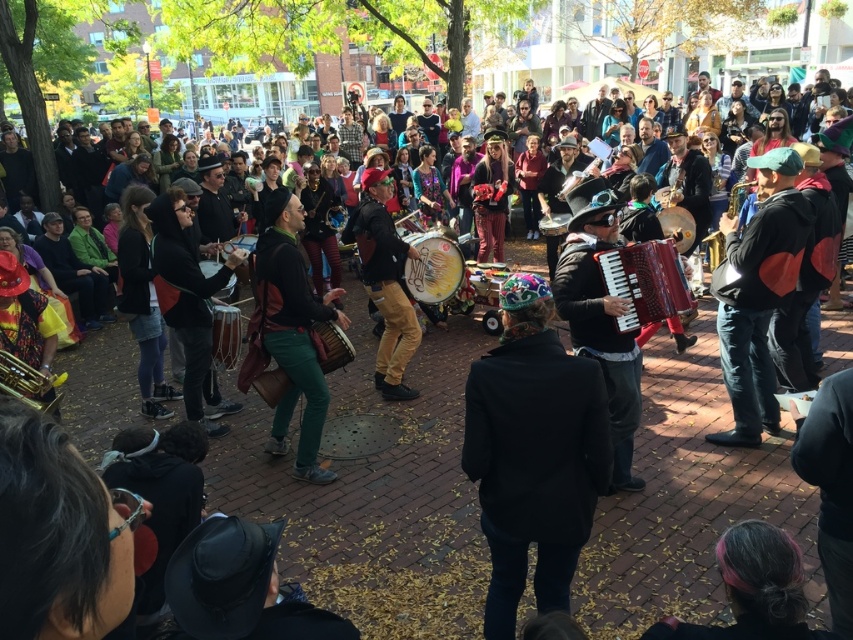
Which of these two, brass/yellowish metal trumpet at lower left or brown leather drum at center, stands shorter?

brown leather drum at center

Is brass/yellowish metal trumpet at lower left smaller than brown leather drum at center?

No, brass/yellowish metal trumpet at lower left is not smaller than brown leather drum at center.

Who is more forward, (x=38, y=381) or (x=277, y=384)?

Positioned in front is point (x=38, y=381).

Identify the location of brass/yellowish metal trumpet at lower left. The image size is (853, 640). (28, 384).

Can you confirm if brass/yellowish metal trumpet at lower left is thinner than matte brown drum at center?

No, brass/yellowish metal trumpet at lower left is not thinner than matte brown drum at center.

This screenshot has width=853, height=640. What do you see at coordinates (28, 384) in the screenshot?
I see `brass/yellowish metal trumpet at lower left` at bounding box center [28, 384].

Between point (4, 364) and point (569, 218), which one is positioned in front?

Point (4, 364) is more forward.

Locate an element on the screen. The height and width of the screenshot is (640, 853). brass/yellowish metal trumpet at lower left is located at coordinates (28, 384).

Can you confirm if shiny black accordion at center is shorter than red matte accordion at center?

No, shiny black accordion at center is not shorter than red matte accordion at center.

Can you confirm if shiny black accordion at center is positioned to the left of red matte accordion at center?

Indeed, shiny black accordion at center is positioned on the left side of red matte accordion at center.

At what (x,y) coordinates should I click in order to perform the action: click on shiny black accordion at center. Please return your answer as a coordinate pair (x, y). The width and height of the screenshot is (853, 640). Looking at the image, I should click on (601, 316).